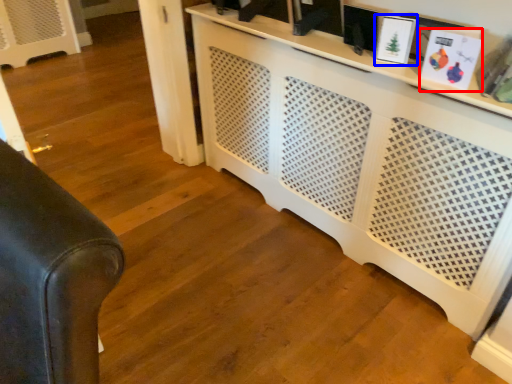
Question: Which object is closer to the camera taking this photo, picture frame (highlighted by a red box) or picture frame (highlighted by a blue box)?

Choices:
 (A) picture frame
 (B) picture frame

Answer: (A)